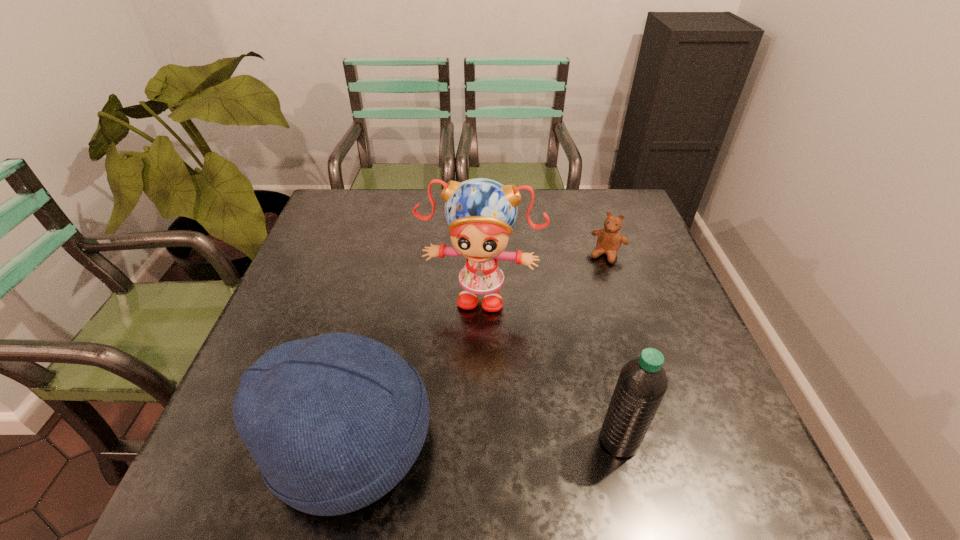
Find the location of a particular element. blank region between the rightmost object and the skullcap is located at coordinates (478, 348).

Where is `unoccupied position between the second object from right to left and the tallest object`? The height and width of the screenshot is (540, 960). unoccupied position between the second object from right to left and the tallest object is located at coordinates (550, 366).

I want to click on free space between the water bottle and the skullcap, so click(x=484, y=441).

You are a GUI agent. You are given a task and a screenshot of the screen. Output one action in this format:
    pyautogui.click(x=<x>, y=<y>)
    Task: Click on the free space that is in between the third object from left to right and the third nearest object
    The width and height of the screenshot is (960, 540).
    Given the screenshot: What is the action you would take?
    pyautogui.click(x=550, y=366)

Locate an element on the screen. Image resolution: width=960 pixels, height=540 pixels. free space between the third object from left to right and the skullcap is located at coordinates (484, 441).

Identify which object is the nearest to the water bottle. Please provide its 2D coordinates. Your answer should be formatted as a tuple, i.e. [(x, y)], where the tuple contains the x and y coordinates of a point satisfying the conditions above.

[(480, 212)]

Identify which object is the nearest to the skullcap. Please provide its 2D coordinates. Your answer should be formatted as a tuple, i.e. [(x, y)], where the tuple contains the x and y coordinates of a point satisfying the conditions above.

[(480, 212)]

You are a GUI agent. You are given a task and a screenshot of the screen. Output one action in this format:
    pyautogui.click(x=<x>, y=<y>)
    Task: Click on the vacant space that satisfies the following two spatial constraints: 1. on the back side of the skullcap; 2. on the left side of the shortest object
    The image size is (960, 540).
    Given the screenshot: What is the action you would take?
    pyautogui.click(x=393, y=254)

Where is `vacant space that satisfies the following two spatial constraints: 1. on the back side of the rightmost object; 2. on the right side of the doll`? The height and width of the screenshot is (540, 960). vacant space that satisfies the following two spatial constraints: 1. on the back side of the rightmost object; 2. on the right side of the doll is located at coordinates (480, 254).